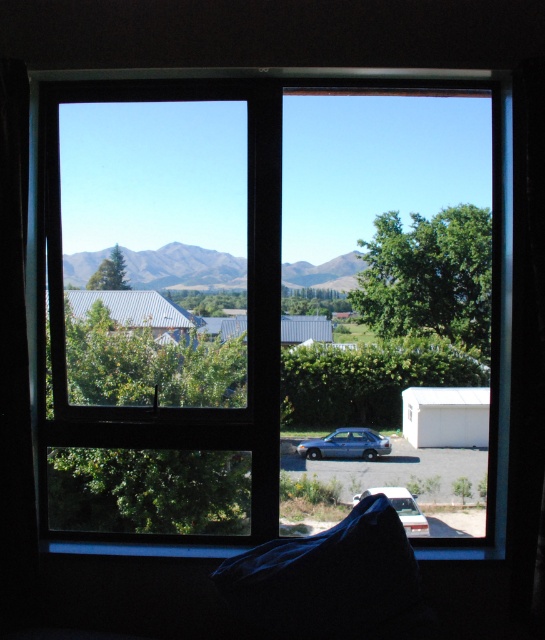
Which is in front, point (220, 253) or point (423, 532)?

Point (220, 253) is more forward.

Locate an element on the screen. green grassy mountain at center is located at coordinates (184, 268).

Where is `green grassy mountain at center`? green grassy mountain at center is located at coordinates (184, 268).

Which is above, transparent glass window at center or metallic blue sedan at center?

transparent glass window at center is above.

Consider the image. Which is more to the right, transparent glass window at center or metallic blue sedan at center?

From the viewer's perspective, transparent glass window at center appears more on the right side.

Which is behind, point (99, 547) or point (378, 451)?

The point (378, 451) is behind.

This screenshot has height=640, width=545. Identify the location of transparent glass window at center. (263, 291).

Can you confirm if transparent glass window at center is shorter than green grassy mountain at center?

In fact, transparent glass window at center may be taller than green grassy mountain at center.

Who is lower down, transparent glass window at center or green grassy mountain at center?

transparent glass window at center is lower down.

Is point (481, 104) in front of point (181, 278)?

Yes, it is in front of point (181, 278).

Find the location of a particular element. transparent glass window at center is located at coordinates (263, 291).